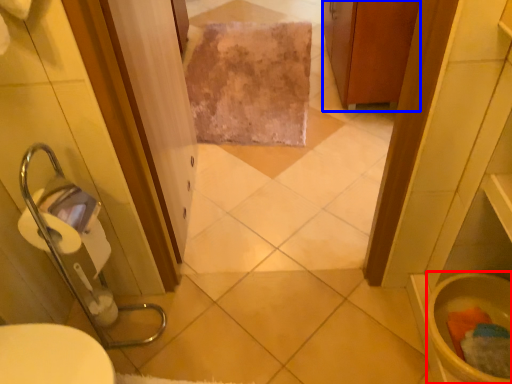
Question: Which of the following is the closest to the observer, toilet bowl (highlighted by a red box) or cabinetry (highlighted by a blue box)?

Choices:
 (A) toilet bowl
 (B) cabinetry

Answer: (A)